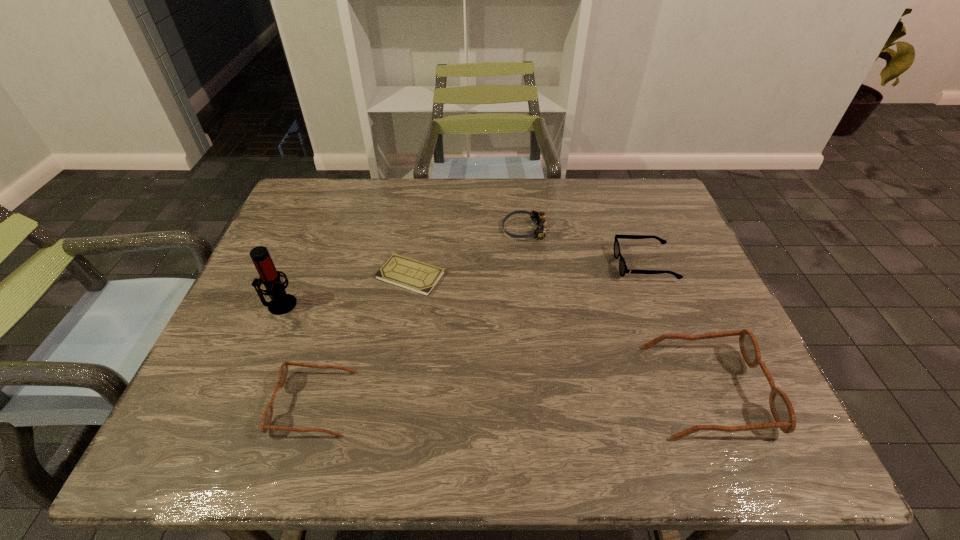
At what (x,y) coordinates should I click in order to perform the action: click on empty location between the second tallest object and the microphone. Please return your answer as a coordinate pair (x, y). The image size is (960, 540). Looking at the image, I should click on (493, 347).

Find the location of `free area in between the shortest object and the farthest spectacles`. free area in between the shortest object and the farthest spectacles is located at coordinates pos(528,270).

This screenshot has width=960, height=540. In order to click on free spot between the tallest object and the checkbook in this screenshot , I will do `click(346, 290)`.

Locate an element on the screen. This screenshot has width=960, height=540. vacant area between the fifth shortest object and the checkbook is located at coordinates (559, 333).

Find the location of a particular element. The image size is (960, 540). vacant area that lies between the shortest spectacles and the leftmost object is located at coordinates (462, 285).

The height and width of the screenshot is (540, 960). In order to click on free space between the farthest spectacles and the fourth object from left to right in this screenshot , I will do `click(585, 247)`.

The image size is (960, 540). What are the coordinates of `the fifth closest object to the checkbook` in the screenshot? It's located at (782, 410).

I want to click on the fourth closest object to the leftmost spectacles, so click(782, 410).

Identify which spectacles is the third closest to the leftmost object. Please provide its 2D coordinates. Your answer should be formatted as a tuple, i.e. [(x, y)], where the tuple contains the x and y coordinates of a point satisfying the conditions above.

[(623, 269)]

The image size is (960, 540). In order to click on spectacles that stands as the closest to the shortest spectacles in this screenshot , I will do `click(782, 410)`.